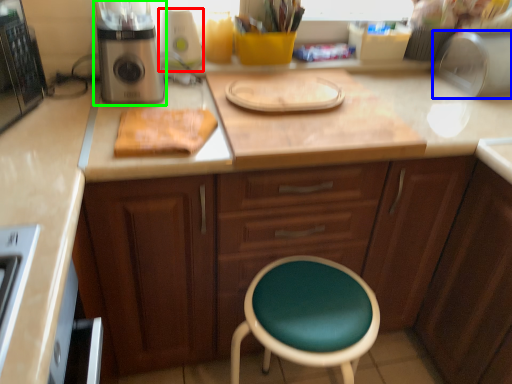
Question: Which is nearer to the appliance (highlighted by a red box)? appliance (highlighted by a blue box) or kitchen appliance (highlighted by a green box).

Choices:
 (A) appliance
 (B) kitchen appliance

Answer: (B)